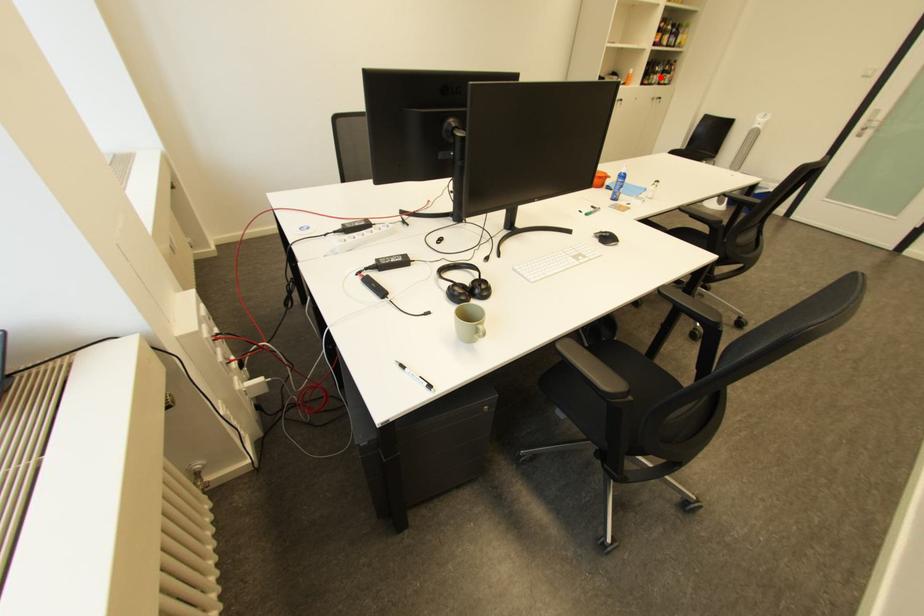
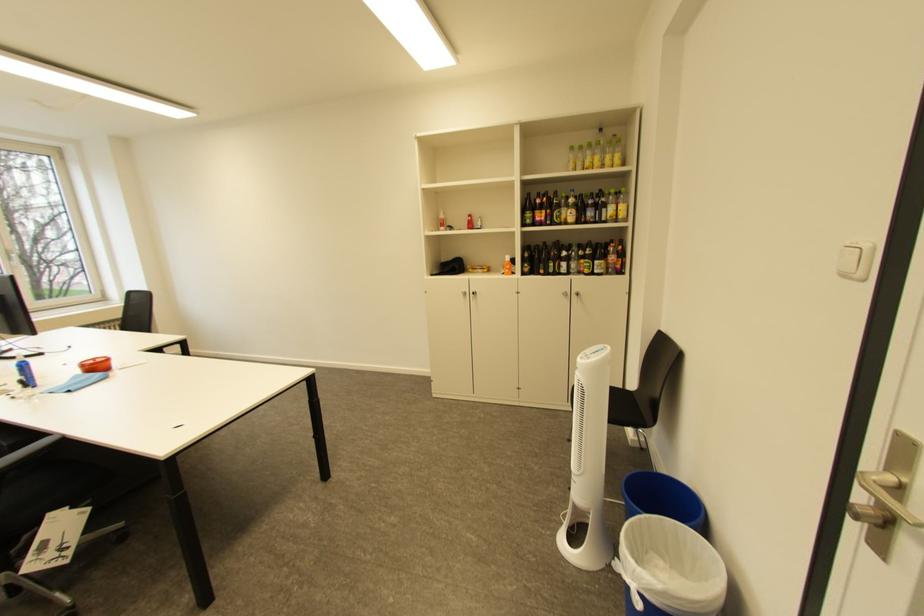
Find the pixel in the second image that matches the highlighted location in the first image.

(562, 265)